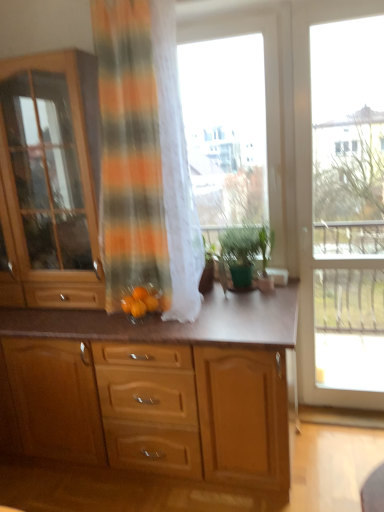
Locate an element on the screen. This screenshot has width=384, height=512. blank space situated above transparent glass window at center, which ranks as the first window in left-to-right order (from a real-world perspective) is located at coordinates (226, 16).